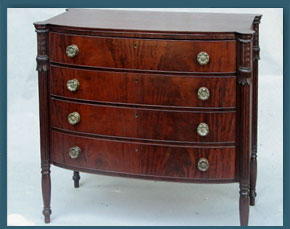
The width and height of the screenshot is (290, 229). Find the location of `left front leg`. left front leg is located at coordinates click(45, 150).